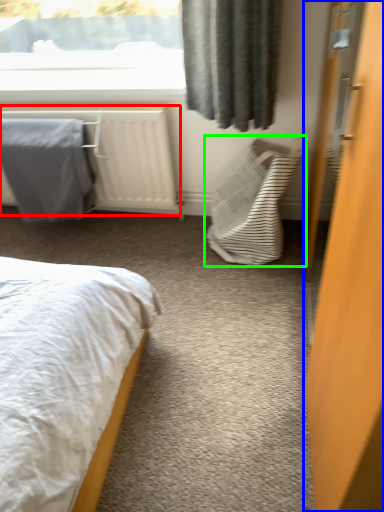
Question: Which object is positioned closest to radiator (highlighted by a red box)? Select from door (highlighted by a blue box) and laundry basket (highlighted by a green box).

Choices:
 (A) door
 (B) laundry basket

Answer: (B)